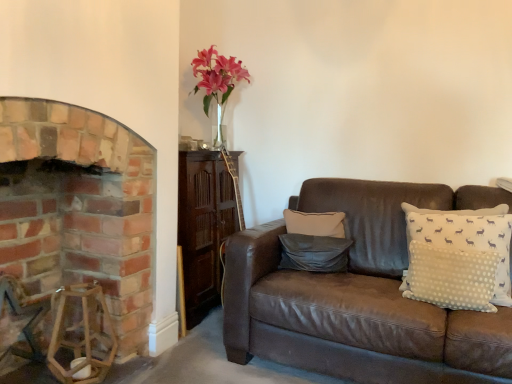
Question: Considering the relative positions of dark gray leather pillow at center, which is the 1th pillow in left-to-right order, and white dotted pillow at right, placed as the 1th pillow when sorted from right to left, in the image provided, is dark gray leather pillow at center, which is the 1th pillow in left-to-right order, behind white dotted pillow at right, placed as the 1th pillow when sorted from right to left,?

Choices:
 (A) no
 (B) yes

Answer: (B)

Question: Would you say dark gray leather pillow at center, which appears as the 2th pillow when viewed from the right, is a long distance from white dotted pillow at right, which is counted as the second pillow, starting from the left?

Choices:
 (A) yes
 (B) no

Answer: (B)

Question: Is dark gray leather pillow at center, which is the 1th pillow in left-to-right order, aimed at white dotted pillow at right, placed as the 1th pillow when sorted from right to left?

Choices:
 (A) no
 (B) yes

Answer: (A)

Question: Is dark gray leather pillow at center, which is the 1th pillow in left-to-right order, not inside white dotted pillow at right, placed as the 1th pillow when sorted from right to left?

Choices:
 (A) yes
 (B) no

Answer: (A)

Question: From a real-world perspective, is dark gray leather pillow at center, which appears as the 2th pillow when viewed from the right, over white dotted pillow at right, which is counted as the second pillow, starting from the left?

Choices:
 (A) no
 (B) yes

Answer: (A)

Question: Can you confirm if dark gray leather pillow at center, which is the 1th pillow in left-to-right order, is positioned to the left of white dotted pillow at right, which is counted as the second pillow, starting from the left?

Choices:
 (A) yes
 (B) no

Answer: (A)

Question: Does brick fireplace at left have a lesser height compared to pink glass vase at upper center?

Choices:
 (A) yes
 (B) no

Answer: (B)

Question: Does brick fireplace at left come behind pink glass vase at upper center?

Choices:
 (A) yes
 (B) no

Answer: (B)

Question: Is brick fireplace at left in front of pink glass vase at upper center?

Choices:
 (A) yes
 (B) no

Answer: (A)

Question: From a real-world perspective, is brick fireplace at left on top of pink glass vase at upper center?

Choices:
 (A) yes
 (B) no

Answer: (B)

Question: From a real-world perspective, is brick fireplace at left beneath pink glass vase at upper center?

Choices:
 (A) yes
 (B) no

Answer: (A)

Question: Is brick fireplace at left to the left of pink glass vase at upper center from the viewer's perspective?

Choices:
 (A) no
 (B) yes

Answer: (B)

Question: Are dark gray leather pillow at center, which appears as the 2th pillow when viewed from the right, and brick fireplace at left located far from each other?

Choices:
 (A) no
 (B) yes

Answer: (A)